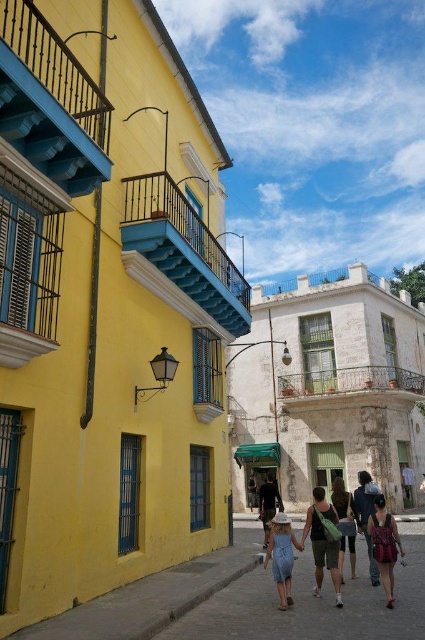
You are a tourist walking along the street in the historic district. You see two points marked on the ground ahead of you. The first point is at coordinate point (368, 483) and the second is at coordinate point (265, 518). Which point is closer to you as you walk towards the yellow building with blue accents?

Point (368, 483) is in front of point (265, 518), so it is closer to you as you walk towards the yellow building with blue accents.

You are a fashion blogger standing in the historic district and see a denim dress at center and dark blue jeans at center. Which clothing item is closer to you?

The denim dress at center is closer to you because it is in front of the dark blue jeans at center.